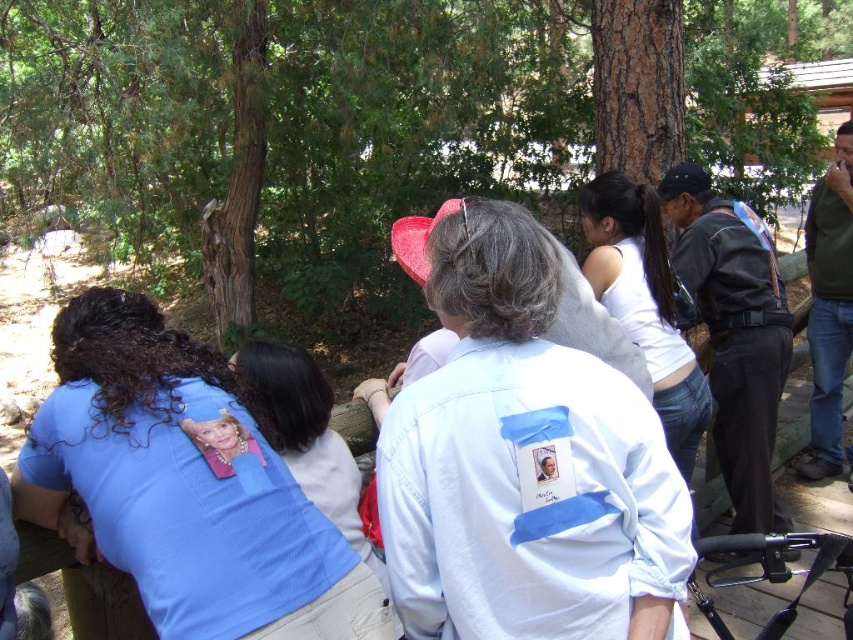
Is brown rough tree at center above blue mesh shirt at center?

Indeed, brown rough tree at center is positioned over blue mesh shirt at center.

Is brown rough tree at center positioned behind blue mesh shirt at center?

Yes, it is.

Does point (140, 193) lie in front of point (277, 429)?

No.

The height and width of the screenshot is (640, 853). I want to click on brown rough tree at center, so click(x=408, y=129).

Between brown rough tree at center and blue mesh shirt at lower left, which one is positioned lower?

blue mesh shirt at lower left

You are a GUI agent. You are given a task and a screenshot of the screen. Output one action in this format:
    pyautogui.click(x=<x>, y=<y>)
    Task: Click on the brown rough tree at center
    
    Given the screenshot: What is the action you would take?
    pos(408,129)

Is point (416, 189) closer to viewer compared to point (296, 556)?

No, (416, 189) is further to viewer.

Where is `brown rough tree at center`? brown rough tree at center is located at coordinates (408, 129).

Consider the image. Can you confirm if blue mesh shirt at lower left is positioned above blue mesh shirt at center?

Actually, blue mesh shirt at lower left is below blue mesh shirt at center.

Is blue mesh shirt at lower left to the right of blue mesh shirt at center from the viewer's perspective?

Incorrect, blue mesh shirt at lower left is not on the right side of blue mesh shirt at center.

Which is behind, point (241, 422) or point (271, 374)?

The point (271, 374) is more distant.

In order to click on blue mesh shirt at lower left in this screenshot , I will do `click(180, 486)`.